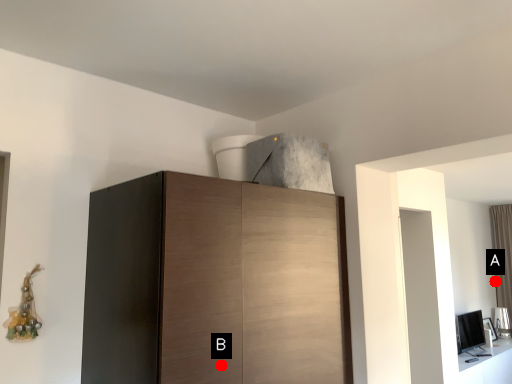
Question: Two points are circled on the image, labeled by A and B beside each circle. Among these points, which one is farthest from the camera?

Choices:
 (A) A is further
 (B) B is further

Answer: (A)